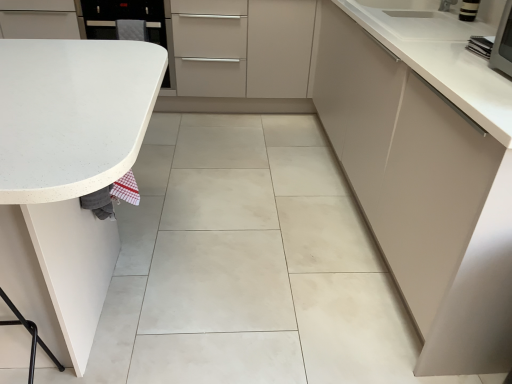
Question: Considering the relative sizes of white speckled laminate countertop at left, arranged as the second countertop when viewed from the top, and white glossy countertop at upper right, the second countertop when ordered from left to right, in the image provided, is white speckled laminate countertop at left, arranged as the second countertop when viewed from the top, taller than white glossy countertop at upper right, the second countertop when ordered from left to right,?

Choices:
 (A) yes
 (B) no

Answer: (A)

Question: Is white speckled laminate countertop at left, which ranks as the second countertop in right-to-left order, far away from white glossy countertop at upper right, the first countertop from the top?

Choices:
 (A) no
 (B) yes

Answer: (B)

Question: Can you confirm if white speckled laminate countertop at left, the first countertop when ordered from bottom to top, is thinner than white glossy countertop at upper right, which ranks as the 1th countertop in right-to-left order?

Choices:
 (A) no
 (B) yes

Answer: (A)

Question: Is white speckled laminate countertop at left, marked as the first countertop in a left-to-right arrangement, closer to the viewer compared to white glossy countertop at upper right, which ranks as the 1th countertop in right-to-left order?

Choices:
 (A) yes
 (B) no

Answer: (A)

Question: Are white speckled laminate countertop at left, arranged as the second countertop when viewed from the top, and white glossy countertop at upper right, the second countertop when ordered from left to right, beside each other?

Choices:
 (A) yes
 (B) no

Answer: (B)

Question: From their relative heights in the image, would you say white glossy oven at upper left is taller or shorter than white speckled laminate countertop at left, which ranks as the second countertop in right-to-left order?

Choices:
 (A) tall
 (B) short

Answer: (B)

Question: Considering the positions of white glossy oven at upper left and white speckled laminate countertop at left, arranged as the second countertop when viewed from the top, in the image, is white glossy oven at upper left wider or thinner than white speckled laminate countertop at left, arranged as the second countertop when viewed from the top,?

Choices:
 (A) thin
 (B) wide

Answer: (A)

Question: In the image, is white glossy oven at upper left on the left side or the right side of white speckled laminate countertop at left, marked as the first countertop in a left-to-right arrangement?

Choices:
 (A) right
 (B) left

Answer: (B)

Question: From the image's perspective, is white glossy oven at upper left positioned above or below white speckled laminate countertop at left, arranged as the second countertop when viewed from the top?

Choices:
 (A) above
 (B) below

Answer: (A)

Question: From their relative heights in the image, would you say white glossy countertop at upper right, marked as the second countertop in a bottom-to-top arrangement, is taller or shorter than matte white cabinet at right?

Choices:
 (A) short
 (B) tall

Answer: (A)

Question: Considering the positions of white glossy countertop at upper right, which ranks as the 1th countertop in right-to-left order, and matte white cabinet at right in the image, is white glossy countertop at upper right, which ranks as the 1th countertop in right-to-left order, wider or thinner than matte white cabinet at right?

Choices:
 (A) wide
 (B) thin

Answer: (B)

Question: From the image's perspective, is white glossy countertop at upper right, which ranks as the 1th countertop in right-to-left order, positioned above or below matte white cabinet at right?

Choices:
 (A) above
 (B) below

Answer: (A)

Question: Does point (423, 33) appear closer or farther from the camera than point (442, 228)?

Choices:
 (A) farther
 (B) closer

Answer: (A)

Question: Is white speckled laminate countertop at left, the first countertop when ordered from bottom to top, to the left or to the right of white glossy countertop at upper right, the second countertop when ordered from left to right, in the image?

Choices:
 (A) right
 (B) left

Answer: (B)

Question: Is white speckled laminate countertop at left, which ranks as the second countertop in right-to-left order, inside or outside of white glossy countertop at upper right, the first countertop from the top?

Choices:
 (A) outside
 (B) inside

Answer: (A)